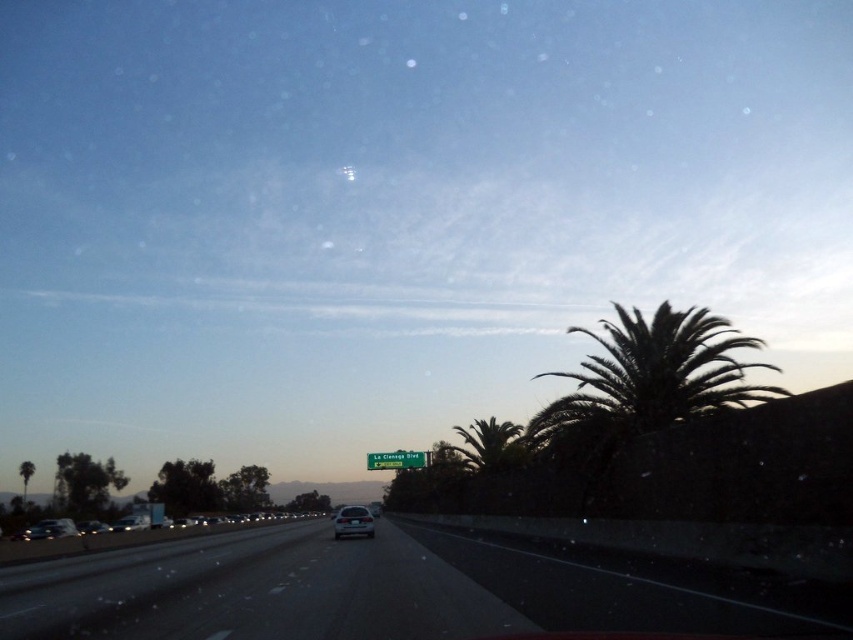
Question: Can you confirm if satin silver sedan at center is wider than green metallic sign at center?

Choices:
 (A) yes
 (B) no

Answer: (A)

Question: Based on their relative distances, which object is nearer to the dark green leafy palm tree at right?

Choices:
 (A) green leafy palm tree at center-right
 (B) satin silver sedan at center

Answer: (A)

Question: Is dark green leafy palm tree at right above silver metallic sedan at center?

Choices:
 (A) no
 (B) yes

Answer: (B)

Question: Does green leafy palm tree at center-right appear over satin silver sedan at center?

Choices:
 (A) no
 (B) yes

Answer: (B)

Question: Which object is closer to the camera taking this photo?

Choices:
 (A) green metallic sign at center
 (B) black asphalt highway at center

Answer: (B)

Question: Which of these objects is positioned farthest from the green leafy palm tree at center-right?

Choices:
 (A) green metallic sign at center
 (B) shiny silver sedan at lower left

Answer: (B)